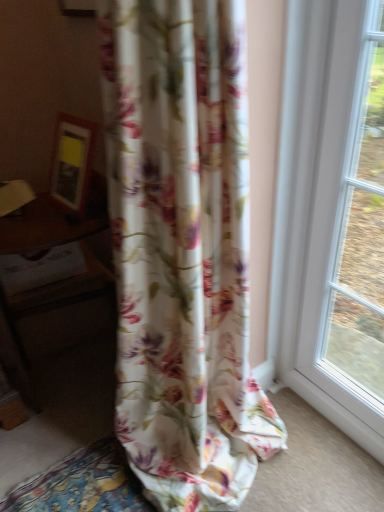
Question: Does point (39, 244) appear closer or farther from the camera than point (223, 377)?

Choices:
 (A) farther
 (B) closer

Answer: (B)

Question: Choose the correct answer: Is wooden table at left inside floral fabric curtain at center or outside it?

Choices:
 (A) outside
 (B) inside

Answer: (A)

Question: From the image's perspective, is wooden table at left located above or below floral fabric curtain at center?

Choices:
 (A) below
 (B) above

Answer: (A)

Question: Looking at their shapes, would you say floral fabric curtain at center is wider or thinner than wooden table at left?

Choices:
 (A) wide
 (B) thin

Answer: (A)

Question: Is floral fabric curtain at center spatially inside wooden table at left, or outside of it?

Choices:
 (A) inside
 (B) outside

Answer: (B)

Question: Would you say floral fabric curtain at center is to the left or to the right of wooden table at left in the picture?

Choices:
 (A) right
 (B) left

Answer: (A)

Question: Considering their positions, is floral fabric curtain at center located in front of or behind wooden table at left?

Choices:
 (A) front
 (B) behind

Answer: (A)